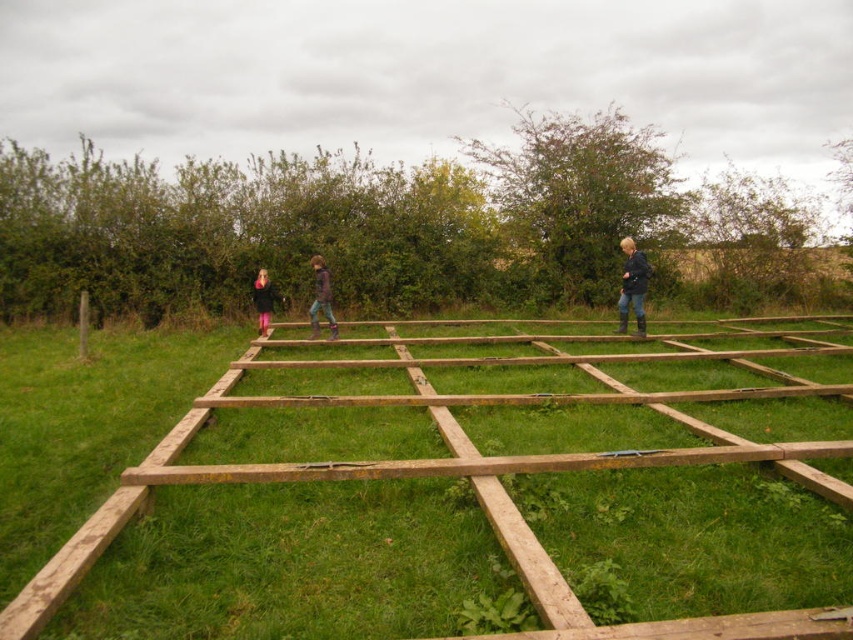
Question: Which point is closer to the camera?

Choices:
 (A) pink fabric pants at center
 (B) green grass at center
 (C) dark blue jacket at center
 (D) purple fuzzy jacket at center

Answer: (B)

Question: Does dark blue jacket at center appear on the left side of purple fuzzy jacket at center?

Choices:
 (A) yes
 (B) no

Answer: (B)

Question: Which object is positioned closest to the pink fabric pants at center?

Choices:
 (A) dark blue jacket at center
 (B) green grass at center

Answer: (B)

Question: Where is green grass at center located in relation to purple fuzzy jacket at center in the image?

Choices:
 (A) left
 (B) right

Answer: (B)

Question: Which of the following is the closest to the observer?

Choices:
 (A) pink fabric pants at center
 (B) dark blue jacket at center
 (C) purple fuzzy jacket at center
 (D) green grass at center

Answer: (D)

Question: Is the position of dark blue jacket at center less distant than that of pink fabric pants at center?

Choices:
 (A) yes
 (B) no

Answer: (A)